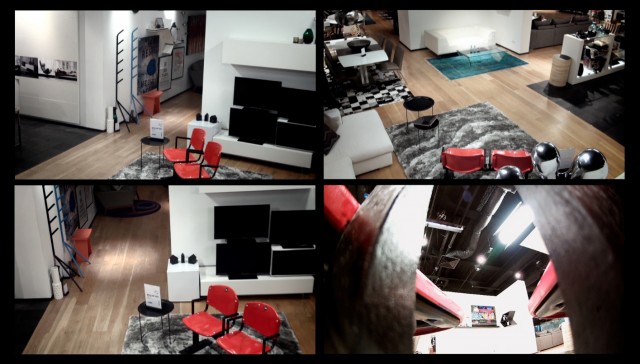
Find the location of `checkerboard rug`. checkerboard rug is located at coordinates (365, 102).